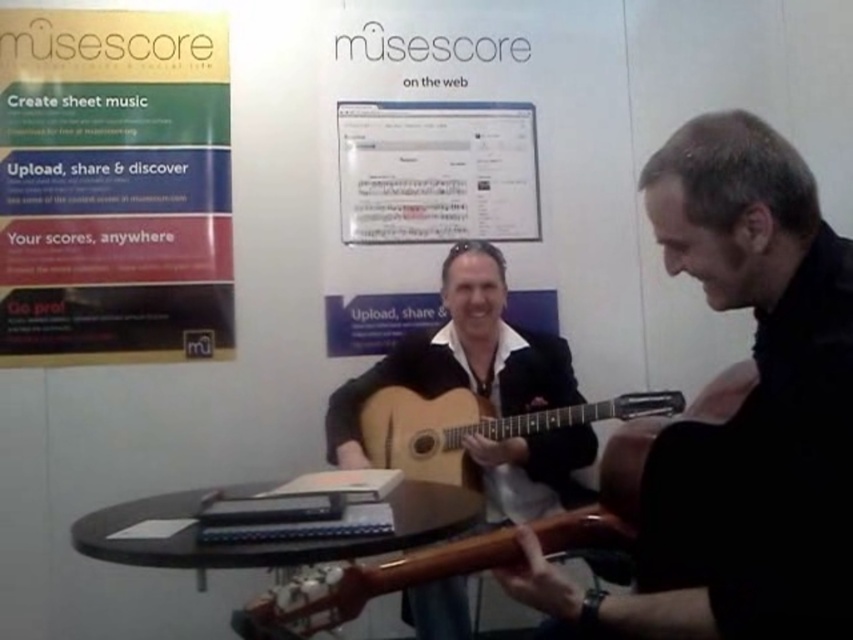
Which of these two, light brown wood guitar at center or glossy wood guitar at center, stands shorter?

Standing shorter between the two is glossy wood guitar at center.

Is point (463, 356) closer to camera compared to point (288, 616)?

No, it is not.

Is point (529, 381) closer to camera compared to point (351, 609)?

No.

Where is `light brown wood guitar at center`? The image size is (853, 640). light brown wood guitar at center is located at coordinates (460, 355).

Can you confirm if matte black guitar at center is smaller than glossy wood guitar at center?

No.

How distant is matte black guitar at center from glossy wood guitar at center?

matte black guitar at center and glossy wood guitar at center are 12.16 inches apart.

Does point (753, 500) come behind point (289, 637)?

No, (753, 500) is closer to viewer.

This screenshot has width=853, height=640. I want to click on matte black guitar at center, so [x=734, y=416].

Can you confirm if matte gold poster at upper left is positioned to the left of natural wood acoustic guitar at center?

Indeed, matte gold poster at upper left is positioned on the left side of natural wood acoustic guitar at center.

Is matte gold poster at upper left positioned before natural wood acoustic guitar at center?

No, matte gold poster at upper left is behind natural wood acoustic guitar at center.

You are a GUI agent. You are given a task and a screenshot of the screen. Output one action in this format:
    pyautogui.click(x=<x>, y=<y>)
    Task: Click on the matte gold poster at upper left
    This screenshot has width=853, height=640.
    Given the screenshot: What is the action you would take?
    pyautogui.click(x=114, y=186)

You are a GUI agent. You are given a task and a screenshot of the screen. Output one action in this format:
    pyautogui.click(x=<x>, y=<y>)
    Task: Click on the matte gold poster at upper left
    
    Given the screenshot: What is the action you would take?
    pyautogui.click(x=114, y=186)